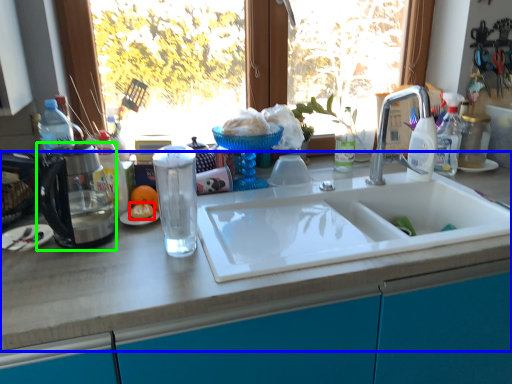
Question: Considering the real-world distances, which object is closest to food (highlighted by a red box)? countertop (highlighted by a blue box) or appliance (highlighted by a green box).

Choices:
 (A) countertop
 (B) appliance

Answer: (B)